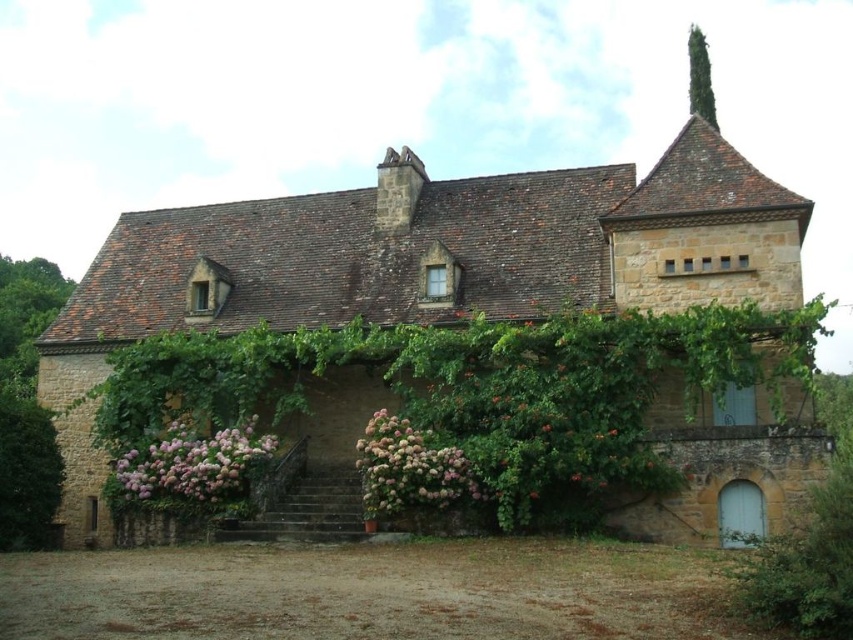
You are standing in front of the stone building and notice two points marked on the facade. The first point is at coordinates point (177, 472) and the second is at point (392, 420). From your perspective, which point is closer to you?

Point (392, 420) is closer to you because point (177, 472) is behind it.

Looking at this image, you are standing in front of the stone building and notice a point marked at coordinates (195,465). What is located at this point?

The point at (195,465) corresponds to the pink fluffy flowers at lower left.